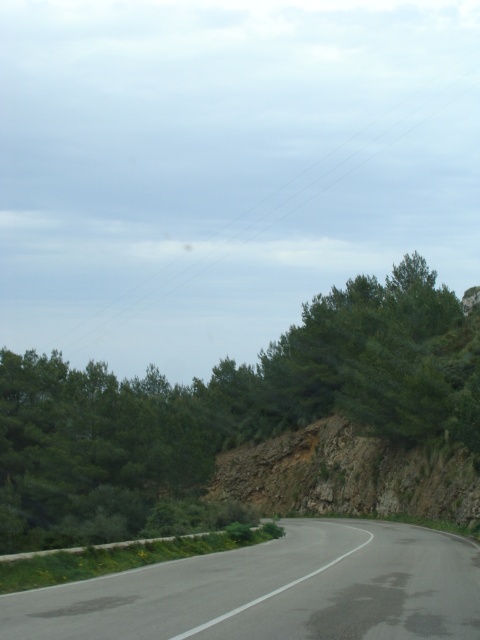
Question: Is green leafy tree at center positioned before black asphalt road at center?

Choices:
 (A) no
 (B) yes

Answer: (A)

Question: Can you confirm if green leafy tree at center is positioned above black asphalt road at center?

Choices:
 (A) yes
 (B) no

Answer: (A)

Question: Observing the image, what is the correct spatial positioning of green leafy tree at center in reference to black asphalt road at center?

Choices:
 (A) right
 (B) left

Answer: (B)

Question: Which of the following is the farthest from the observer?

Choices:
 (A) (60, 532)
 (B) (351, 554)

Answer: (A)